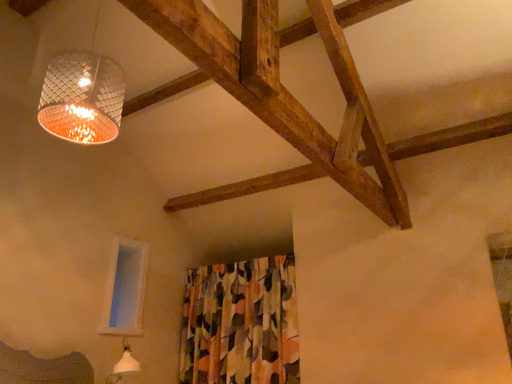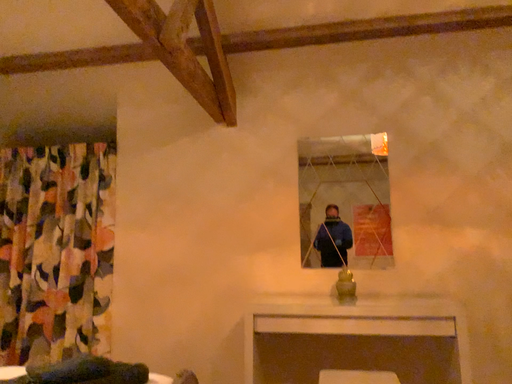
Question: Which way did the camera rotate in the video?

Choices:
 (A) rotated left
 (B) rotated right

Answer: (B)